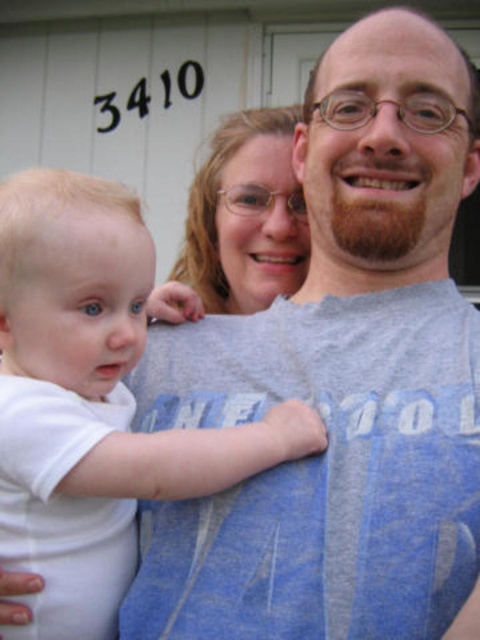
Is point (11, 268) behind point (303, 240)?

No.

From the picture: Who is lower down, white soft baby at center or matte gray hair at center?

Positioned lower is white soft baby at center.

This screenshot has width=480, height=640. What do you see at coordinates (100, 390) in the screenshot? I see `white soft baby at center` at bounding box center [100, 390].

You are a GUI agent. You are given a task and a screenshot of the screen. Output one action in this format:
    pyautogui.click(x=<x>, y=<y>)
    Task: Click on the white soft baby at center
    
    Given the screenshot: What is the action you would take?
    pyautogui.click(x=100, y=390)

Does point (240, 637) lie in front of point (74, 250)?

Yes, point (240, 637) is closer to viewer.

Between gray cotton t-shirt at center and white soft baby at center, which one has less height?

Standing shorter between the two is white soft baby at center.

The height and width of the screenshot is (640, 480). What do you see at coordinates (340, 380) in the screenshot?
I see `gray cotton t-shirt at center` at bounding box center [340, 380].

You are a GUI agent. You are given a task and a screenshot of the screen. Output one action in this format:
    pyautogui.click(x=<x>, y=<y>)
    Task: Click on the gray cotton t-shirt at center
    
    Given the screenshot: What is the action you would take?
    pyautogui.click(x=340, y=380)

Who is more forward, (372, 51) or (277, 150)?

Point (372, 51) is in front.

Identify the location of gray cotton t-shirt at center. This screenshot has width=480, height=640. (340, 380).